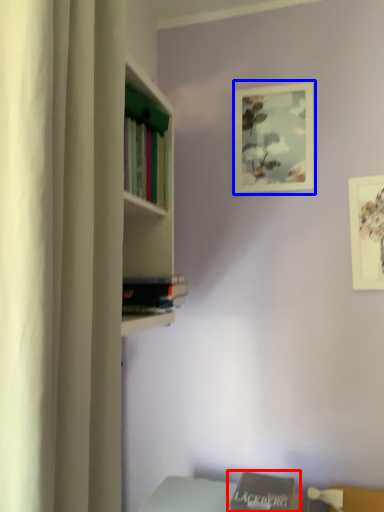
Question: Which of the following is the farthest to the observer, book (highlighted by a red box) or picture frame (highlighted by a blue box)?

Choices:
 (A) book
 (B) picture frame

Answer: (B)